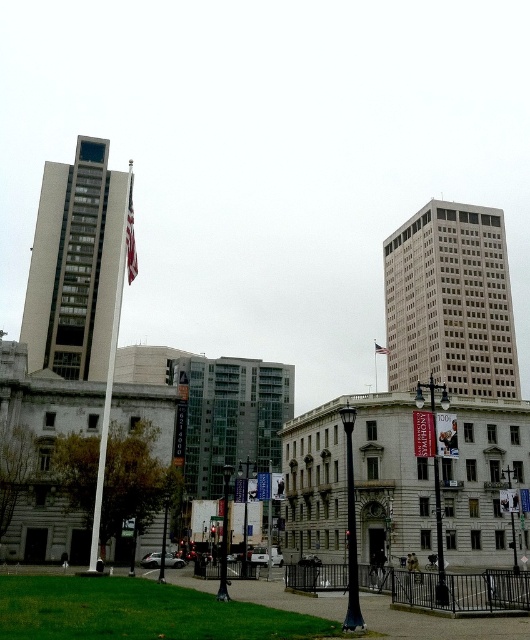
You are a city planner reviewing this area. You need to install a new sculpture that is the same size as the gray concrete building at center. Will it be larger than the polished silver flag pole at center?

The gray concrete building at center is smaller than the polished silver flag pole at center, so the sculpture will also be smaller than the flag pole.

You are a photographer trying to capture both the polished silver flag pole at center and the american flag at center in a single shot. Based on their sizes, which object should you focus on first to ensure both are in frame?

The polished silver flag pole at center is bigger than the american flag at center, so you should focus on the polished silver flag pole at center first to ensure both are in frame.